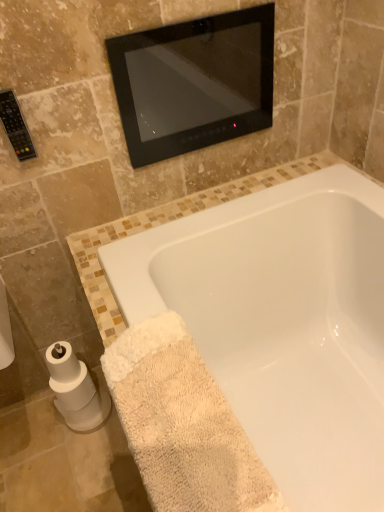
What are the coordinates of `empty space that is ontop of beige terry cloth bath towel at lower right` in the screenshot? It's located at (193, 404).